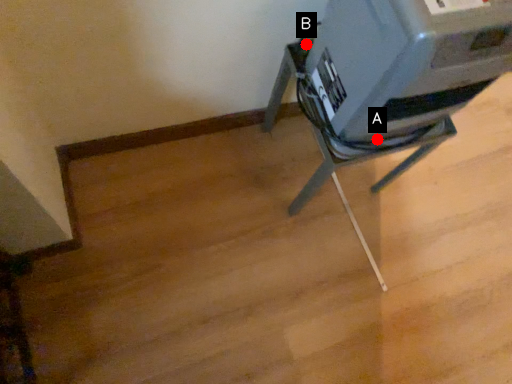
Question: Two points are circled on the image, labeled by A and B beside each circle. Which point is closer to the camera?

Choices:
 (A) A is closer
 (B) B is closer

Answer: (A)